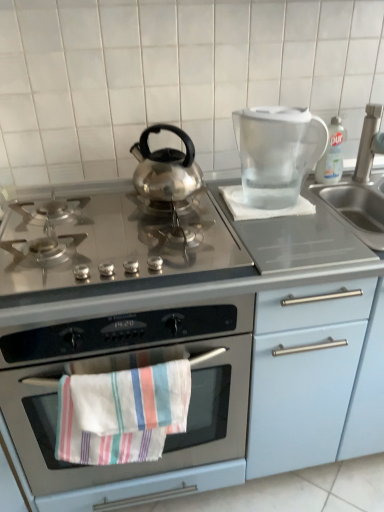
The image size is (384, 512). What do you see at coordinates (332, 154) in the screenshot?
I see `clear plastic bottle at upper right` at bounding box center [332, 154].

This screenshot has width=384, height=512. What do you see at coordinates (128, 368) in the screenshot?
I see `stainless steel oven at center` at bounding box center [128, 368].

Locate an element on the screen. The width and height of the screenshot is (384, 512). striped cotton towel at center is located at coordinates (121, 413).

Find the location of a particular element. The width and height of the screenshot is (384, 512). gas stove in front of the striped cotton towel at center is located at coordinates (x=112, y=245).

Who is smaller, stainless steel gas stove at center or striped cotton towel at center?

With smaller size is striped cotton towel at center.

Is stainless steel gas stove at center next to striped cotton towel at center and touching it?

They are not placed beside each other.

From the image's perspective, would you say stainless steel gas stove at center is positioned over striped cotton towel at center?

Yes, from the image's perspective, stainless steel gas stove at center is on top of striped cotton towel at center.

Is point (148, 442) positioned in front of point (286, 198)?

Yes, it is.

Is striped cotton towel at center positioned with its back to transparent plastic pitcher at upper right?

No.

From their relative heights in the image, would you say striped cotton towel at center is taller or shorter than transparent plastic pitcher at upper right?

In the image, striped cotton towel at center appears to be taller than transparent plastic pitcher at upper right.

Find the location of a particular element. This screenshot has width=384, height=512. faucet above the stainless steel oven at center (from a real-world perspective) is located at coordinates (369, 143).

Is stainless steel oven at center at the back of satin nickel faucet at right?

No, satin nickel faucet at right is not facing away from stainless steel oven at center.

What's the angular difference between satin nickel faucet at right and stainless steel oven at center's facing directions?

They differ by 1.85 degrees in their facing directions.

Which object is positioned more to the right, satin nickel faucet at right or stainless steel oven at center?

From the viewer's perspective, satin nickel faucet at right appears more on the right side.

How different are the orientations of stainless steel oven at center and clear plastic bottle at upper right in degrees?

They differ by 2.46 degrees in their facing directions.

Is stainless steel oven at center to the left or to the right of clear plastic bottle at upper right in the image?

Based on their positions, stainless steel oven at center is located to the left of clear plastic bottle at upper right.

Which point is more forward, (91, 327) or (328, 179)?

The point (91, 327) is closer to the camera.

Does stainless steel oven at center have a lesser height compared to clear plastic bottle at upper right?

Incorrect, the height of stainless steel oven at center does not fall short of that of clear plastic bottle at upper right.

Are clear plastic bottle at upper right and striped cotton towel at center making contact?

No, clear plastic bottle at upper right is not next to striped cotton towel at center.

In the scene shown: Is clear plastic bottle at upper right inside or outside of striped cotton towel at center?

clear plastic bottle at upper right is spatially situated outside striped cotton towel at center.

Considering the relative positions of clear plastic bottle at upper right and striped cotton towel at center in the image provided, is clear plastic bottle at upper right behind striped cotton towel at center?

Yes, it is behind striped cotton towel at center.

Can you tell me how much clear plastic bottle at upper right and transparent plastic pitcher at upper right differ in facing direction?

clear plastic bottle at upper right and transparent plastic pitcher at upper right are facing 90.9 degrees away from each other.

Does clear plastic bottle at upper right appear on the left side of transparent plastic pitcher at upper right?

Incorrect, clear plastic bottle at upper right is not on the left side of transparent plastic pitcher at upper right.

Does clear plastic bottle at upper right touch transparent plastic pitcher at upper right?

No, clear plastic bottle at upper right is not touching transparent plastic pitcher at upper right.

From a real-world perspective, is clear plastic bottle at upper right physically located above or below transparent plastic pitcher at upper right?

clear plastic bottle at upper right is situated lower than transparent plastic pitcher at upper right in the real world.

Which is behind, point (240, 377) or point (281, 121)?

The point (240, 377) is farther from the camera.

Consider the image. Is stainless steel oven at center touching transparent plastic pitcher at upper right?

stainless steel oven at center and transparent plastic pitcher at upper right are not in contact.

From a real-world perspective, which is physically above, stainless steel oven at center or transparent plastic pitcher at upper right?

From a 3D spatial view, transparent plastic pitcher at upper right is above.

Between stainless steel oven at center and transparent plastic pitcher at upper right, which one appears on the left side from the viewer's perspective?

Positioned to the left is stainless steel oven at center.

What are the coordinates of `beach towel behind the stainless steel gas stove at center` in the screenshot? It's located at (121, 413).

At what (x,y) coordinates should I click in order to perform the action: click on kitchen appliance that appears above the striped cotton towel at center (from the image's perspective). Please return your answer as a coordinate pair (x, y). This screenshot has width=384, height=512. Looking at the image, I should click on tap(277, 152).

When comparing their distances from transparent plastic pitcher at upper right, does stainless steel oven at center or satin nickel faucet at right seem closer?

Among the two, satin nickel faucet at right is located nearer to transparent plastic pitcher at upper right.

Considering their positions, is stainless steel gas stove at center positioned further to clear plastic bottle at upper right than transparent plastic pitcher at upper right?

Based on the image, stainless steel gas stove at center appears to be further to clear plastic bottle at upper right.

Which object lies nearer to the anchor point striped cotton towel at center, stainless steel oven at center or transparent plastic pitcher at upper right?

Among the two, stainless steel oven at center is located nearer to striped cotton towel at center.

When comparing their distances from transparent plastic pitcher at upper right, does striped cotton towel at center or clear plastic bottle at upper right seem closer?

clear plastic bottle at upper right is positioned closer to the anchor transparent plastic pitcher at upper right.

Based on their spatial positions, is stainless steel oven at center or transparent plastic pitcher at upper right closer to stainless steel gas stove at center?

The object closer to stainless steel gas stove at center is stainless steel oven at center.

Looking at the image, which one is located closer to stainless steel gas stove at center, satin nickel faucet at right or striped cotton towel at center?

striped cotton towel at center lies closer to stainless steel gas stove at center than the other object.

When comparing their distances from stainless steel gas stove at center, does clear plastic bottle at upper right or stainless steel oven at center seem further?

clear plastic bottle at upper right is further to stainless steel gas stove at center.

From the image, which object appears to be nearer to transparent plastic pitcher at upper right, satin nickel faucet at right or stainless steel gas stove at center?

Among the two, stainless steel gas stove at center is located nearer to transparent plastic pitcher at upper right.

This screenshot has height=512, width=384. I want to click on kitchen appliance between clear plastic bottle at upper right and striped cotton towel at center in the vertical direction, so click(x=277, y=152).

The height and width of the screenshot is (512, 384). Find the location of `gas stove between transparent plastic pitcher at upper right and striped cotton towel at center in the up-down direction`. gas stove between transparent plastic pitcher at upper right and striped cotton towel at center in the up-down direction is located at coordinates (112, 245).

At what (x,y) coordinates should I click in order to perform the action: click on kitchen appliance between stainless steel gas stove at center and satin nickel faucet at right. Please return your answer as a coordinate pair (x, y). The image size is (384, 512). Looking at the image, I should click on (277, 152).

Image resolution: width=384 pixels, height=512 pixels. In order to click on kitchen appliance between satin nickel faucet at right and striped cotton towel at center from top to bottom in this screenshot , I will do pyautogui.click(x=277, y=152).